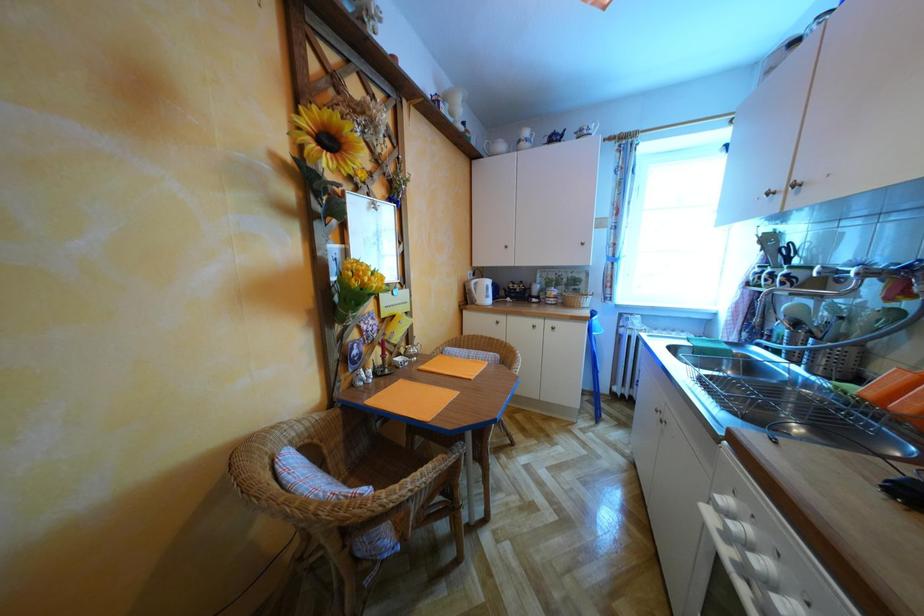
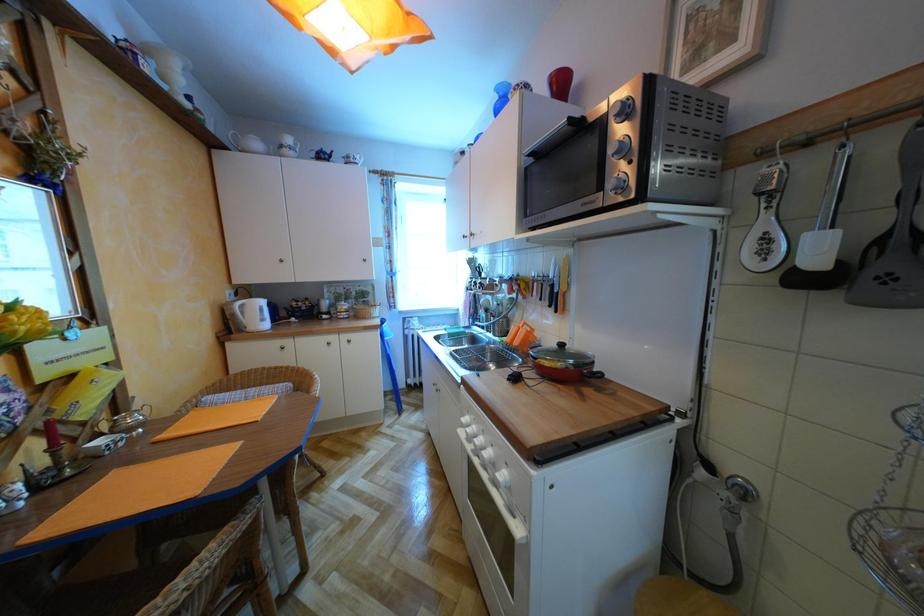
Question: The first image is from the beginning of the video and the second image is from the end. How did the camera likely rotate when shooting the video?

Choices:
 (A) Left
 (B) Right
 (C) Up
 (D) Down

Answer: (B)